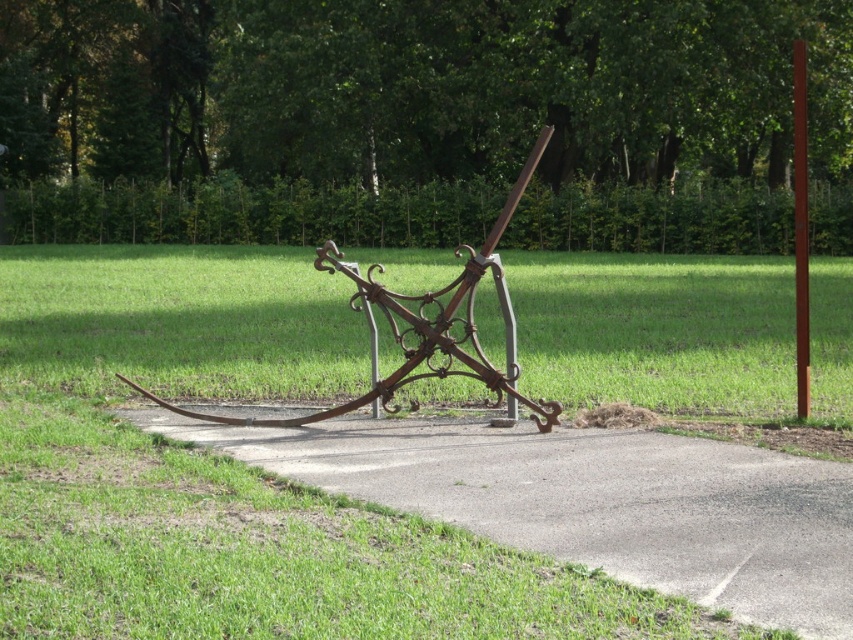
You are standing in the park and see the metal sculpture. What is the exact location of the point with coordinates point (418, 326)?

The point (418, 326) corresponds to the rusty wrought iron sculpture at center.

You are standing at the edge of the gray concrete pavement at center. If you walk straight ahead, will you step onto the grass or stay on the pavement?

Since the gray concrete pavement at center is located at point (592, 500), walking straight ahead from the edge would lead you onto the grass, as the pavement is bordered by grass on both sides according to the scene description.

You are a gardener who needs to place a new flower pot that is 10 cm tall. You have two options for placement on the gray concrete pavement at center or the smooth brown pole at right. Based on their heights, which location would be more stable for the flower pot?

The gray concrete pavement at center has a lesser height compared to the smooth brown pole at right. Therefore, placing the flower pot on the gray concrete pavement at center would be more stable since it is lower to the ground and provides a firmer base.